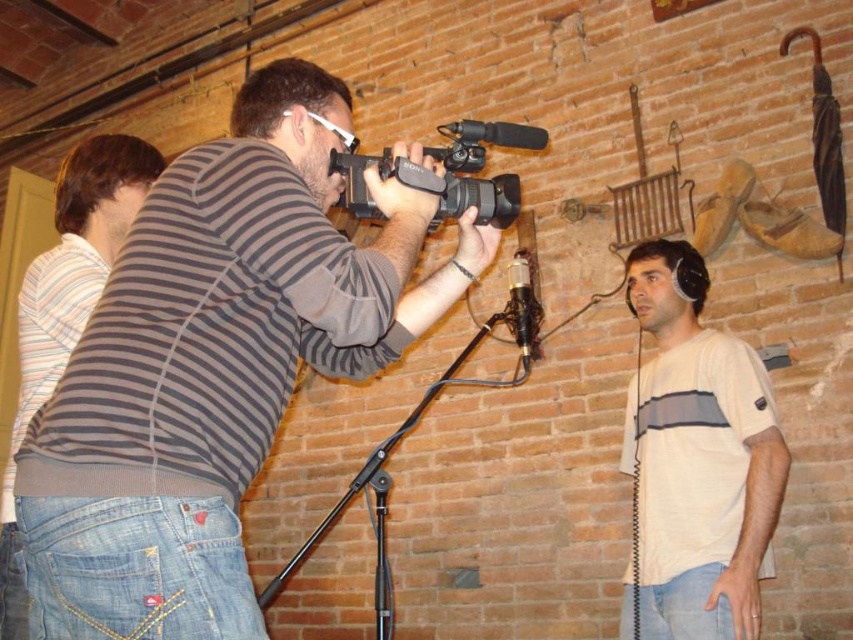
Question: Among these objects, which one is farthest from the camera?

Choices:
 (A) black plastic video camera at center
 (B) denim jeans at left
 (C) black metal tripod at center

Answer: (C)

Question: Among these points, which one is farthest from the camera?

Choices:
 (A) (419, 417)
 (B) (485, 216)
 (C) (677, 324)
 (D) (97, 563)

Answer: (C)

Question: Can you confirm if striped sweater at center is smaller than black plastic video camera at center?

Choices:
 (A) yes
 (B) no

Answer: (B)

Question: Which object is the farthest from the white cotton t-shirt at right?

Choices:
 (A) black metal tripod at center
 (B) denim jeans at left
 (C) black plastic video camera at center
 (D) striped sweater at center

Answer: (B)

Question: Is striped sweater at center thinner than black plastic video camera at center?

Choices:
 (A) yes
 (B) no

Answer: (B)

Question: Is the position of white cotton t-shirt at right less distant than that of denim jeans at left?

Choices:
 (A) no
 (B) yes

Answer: (A)